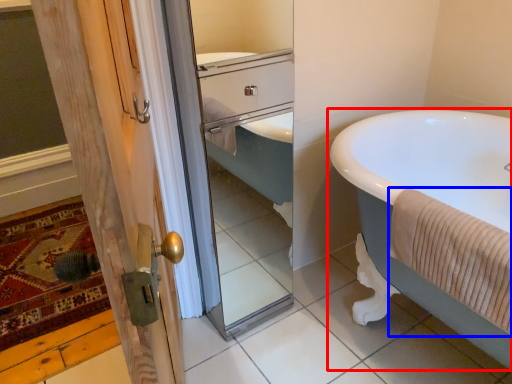
Question: Which point is closer to the camera, bathtub (highlighted by a red box) or bath towel (highlighted by a blue box)?

Choices:
 (A) bathtub
 (B) bath towel

Answer: (A)